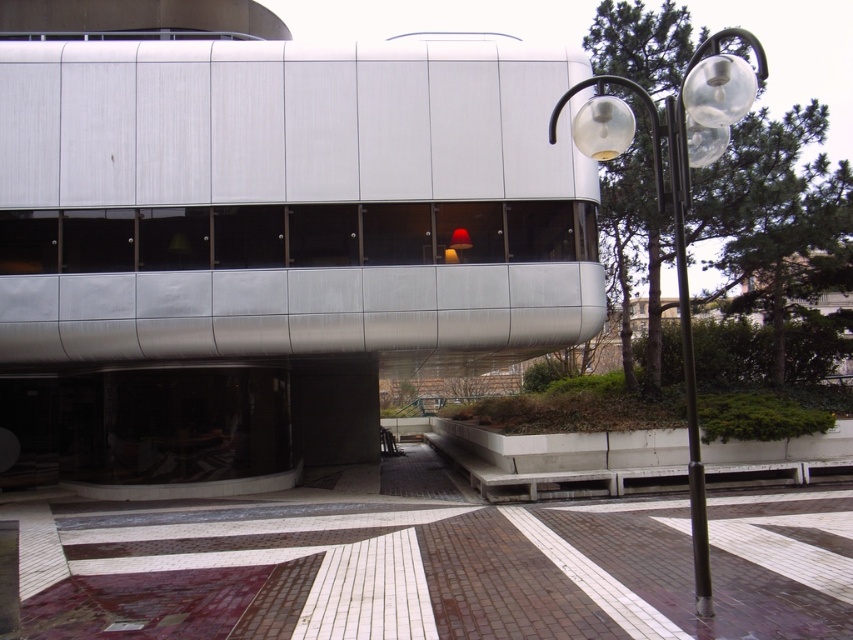
Question: Is brown brick pavement at center thinner than black metal pole at right?

Choices:
 (A) yes
 (B) no

Answer: (B)

Question: Is brown brick pavement at center positioned before black metal pole at right?

Choices:
 (A) no
 (B) yes

Answer: (B)

Question: Which is farther from the black metal pole at right?

Choices:
 (A) clear glass lamp post at right
 (B) brown brick pavement at center

Answer: (B)

Question: Among these objects, which one is farthest from the camera?

Choices:
 (A) black metal pole at right
 (B) clear glass lamp post at right

Answer: (A)

Question: Which object is the closest to the brown brick pavement at center?

Choices:
 (A) clear glass lamp post at right
 (B) black metal pole at right

Answer: (B)

Question: In this image, where is brown brick pavement at center located relative to clear glass lamp post at right?

Choices:
 (A) right
 (B) left

Answer: (B)